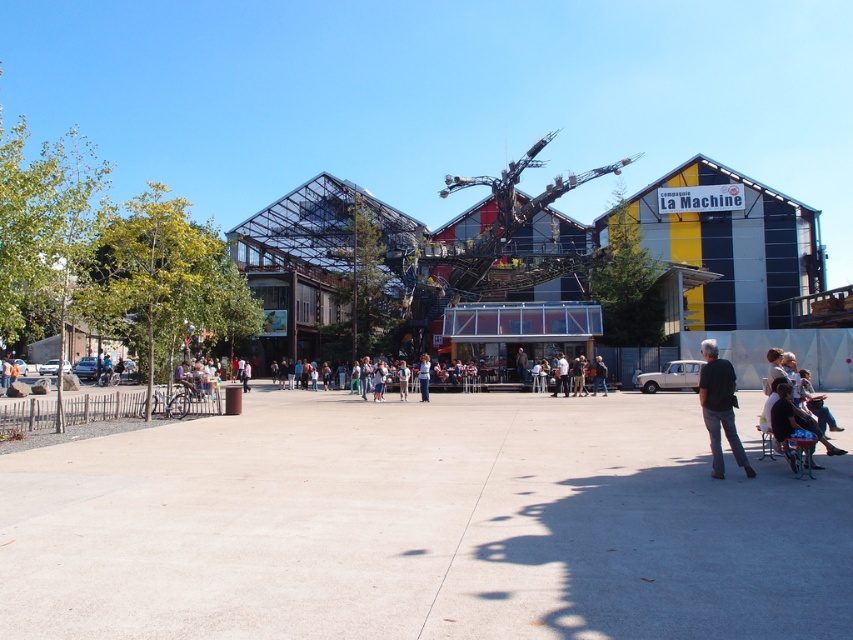
Which of these two, metallic structure at center or black fabric pants at lower right, stands taller?

metallic structure at center

Who is positioned more to the right, metallic structure at center or black fabric pants at lower right?

metallic structure at center

Is point (554, 227) positioned before point (700, 396)?

No, (554, 227) is behind (700, 396).

Where is `metallic structure at center`? This screenshot has height=640, width=853. metallic structure at center is located at coordinates (415, 268).

Is the position of black fabric pants at lower right more distant than that of green plastic baby carriage at lower right?

No, it is in front of green plastic baby carriage at lower right.

Between black fabric pants at lower right and green plastic baby carriage at lower right, which one appears on the right side from the viewer's perspective?

green plastic baby carriage at lower right

Is point (715, 364) farther from camera compared to point (815, 436)?

Yes, point (715, 364) is behind point (815, 436).

Where is `black fabric pants at lower right`? This screenshot has height=640, width=853. black fabric pants at lower right is located at coordinates (718, 406).

Can you confirm if metallic structure at center is smaller than green plastic baby carriage at lower right?

Actually, metallic structure at center might be larger than green plastic baby carriage at lower right.

Does point (477, 336) lie in front of point (782, 435)?

No, (477, 336) is further to viewer.

I want to click on metallic structure at center, so click(415, 268).